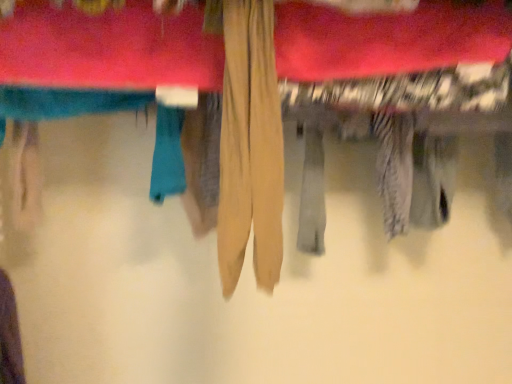
What is the approximate height of tan fabric pants at center?

The height of tan fabric pants at center is 36.14 centimeters.

You are a GUI agent. You are given a task and a screenshot of the screen. Output one action in this format:
    pyautogui.click(x=<x>, y=<y>)
    Task: Click on the tan fabric pants at center
    The width and height of the screenshot is (512, 384).
    Given the screenshot: What is the action you would take?
    pyautogui.click(x=250, y=146)

What do you see at coordinates (250, 146) in the screenshot? I see `tan fabric pants at center` at bounding box center [250, 146].

This screenshot has height=384, width=512. Find the location of `beige fabric towel at center`. beige fabric towel at center is located at coordinates tap(108, 48).

This screenshot has width=512, height=384. What do you see at coordinates (108, 48) in the screenshot?
I see `beige fabric towel at center` at bounding box center [108, 48].

Find the location of a particular element. tan fabric pants at center is located at coordinates (250, 146).

Considering the positions of objects beige fabric towel at center and tan fabric pants at center in the image provided, who is more to the right, beige fabric towel at center or tan fabric pants at center?

beige fabric towel at center.

Does beige fabric towel at center come in front of tan fabric pants at center?

No.

Between point (443, 59) and point (229, 280), which one is positioned behind?

Point (443, 59)

From the image's perspective, which one is positioned higher, beige fabric towel at center or tan fabric pants at center?

From the image's view, beige fabric towel at center is above.

In the scene shown: From a real-world perspective, does beige fabric towel at center stand above tan fabric pants at center?

Yes.

Which object is wider, beige fabric towel at center or tan fabric pants at center?

With larger width is tan fabric pants at center.

In terms of height, does beige fabric towel at center look taller or shorter compared to tan fabric pants at center?

beige fabric towel at center is shorter than tan fabric pants at center.

Who is bigger, beige fabric towel at center or tan fabric pants at center?

With larger size is beige fabric towel at center.

Is tan fabric pants at center completely or partially inside beige fabric towel at center?

No.

Is beige fabric towel at center placed right next to tan fabric pants at center?

There is a gap between beige fabric towel at center and tan fabric pants at center.

Could you tell me if beige fabric towel at center is facing tan fabric pants at center?

No, beige fabric towel at center is not aimed at tan fabric pants at center.

What's the angular difference between beige fabric towel at center and tan fabric pants at center's facing directions?

There is a 4.74-degree angle between the facing directions of beige fabric towel at center and tan fabric pants at center.

In the scene shown: Measure the distance from beige fabric towel at center to tan fabric pants at center.

beige fabric towel at center and tan fabric pants at center are 7.72 inches apart.

Where is `towel on the right side of tan fabric pants at center`? The width and height of the screenshot is (512, 384). towel on the right side of tan fabric pants at center is located at coordinates (108, 48).

Considering the relative positions of tan fabric pants at center and beige fabric towel at center in the image provided, is tan fabric pants at center to the left of beige fabric towel at center from the viewer's perspective?

Indeed, tan fabric pants at center is positioned on the left side of beige fabric towel at center.

Is the depth of tan fabric pants at center less than that of beige fabric towel at center?

Yes, tan fabric pants at center is closer to the viewer.

Is point (240, 134) less distant than point (190, 23)?

Yes, point (240, 134) is closer to viewer.

From the image's perspective, is tan fabric pants at center under beige fabric towel at center?

Correct, tan fabric pants at center appears lower than beige fabric towel at center in the image.

From a real-world perspective, between tan fabric pants at center and beige fabric towel at center, who is vertically higher?

beige fabric towel at center is physically above.

Does tan fabric pants at center have a lesser width compared to beige fabric towel at center?

No, tan fabric pants at center is not thinner than beige fabric towel at center.

Looking at this image, is tan fabric pants at center shorter than beige fabric towel at center?

No, tan fabric pants at center is not shorter than beige fabric towel at center.

Looking at the image, does tan fabric pants at center seem bigger or smaller compared to beige fabric towel at center?

tan fabric pants at center is smaller than beige fabric towel at center.

Do you think tan fabric pants at center is within beige fabric towel at center, or outside of it?

tan fabric pants at center is spatially situated outside beige fabric towel at center.

Is tan fabric pants at center not near beige fabric towel at center?

tan fabric pants at center is near beige fabric towel at center, not far away.

Is tan fabric pants at center turned away from beige fabric towel at center?

tan fabric pants at center does not have its back to beige fabric towel at center.

Based on the photo, can you tell me how much tan fabric pants at center and beige fabric towel at center differ in facing direction?

The angular difference between tan fabric pants at center and beige fabric towel at center is 4.74 degrees.

There is a tan fabric pants at center. At what (x,y) coordinates should I click in order to perform the action: click on towel above it (from a real-world perspective). Please return your answer as a coordinate pair (x, y). Looking at the image, I should click on (108, 48).

You are a GUI agent. You are given a task and a screenshot of the screen. Output one action in this format:
    pyautogui.click(x=<x>, y=<y>)
    Task: Click on the clothing located in front of the beige fabric towel at center
    
    Given the screenshot: What is the action you would take?
    pyautogui.click(x=250, y=146)

Identify the location of clothing below the beige fabric towel at center (from a real-world perspective). This screenshot has width=512, height=384. (250, 146).